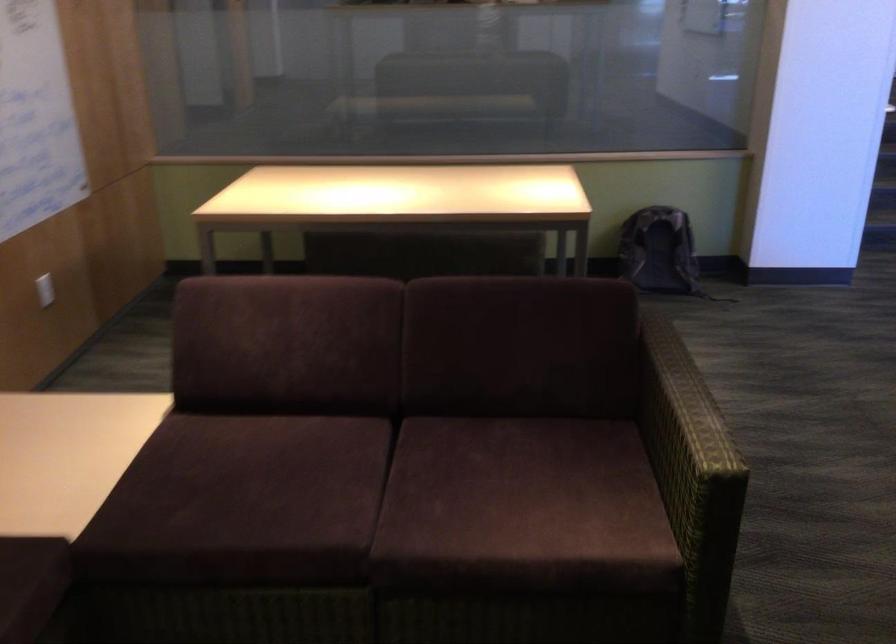
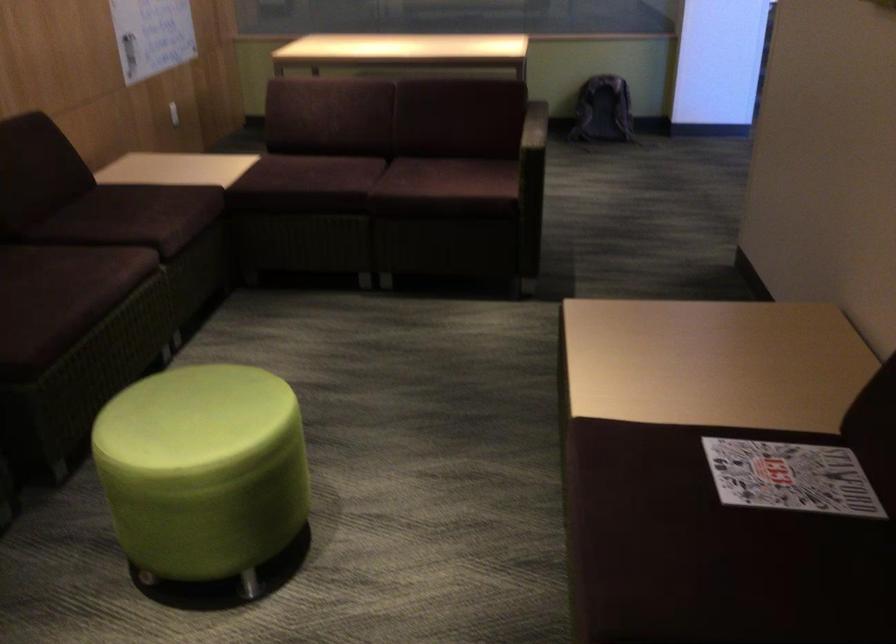
In the second image, find the point that corresponds to (701,451) in the first image.

(533, 138)